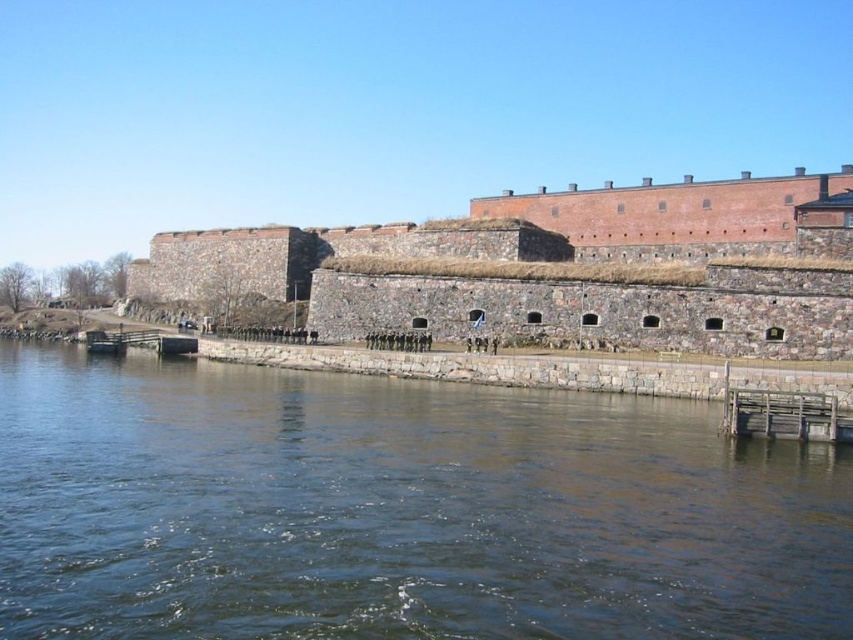
Is dark blue water at center smaller than wooden dock at lower left?

No, dark blue water at center is not smaller than wooden dock at lower left.

How much distance is there between dark blue water at center and wooden dock at lower left?

A distance of 39.29 meters exists between dark blue water at center and wooden dock at lower left.

This screenshot has height=640, width=853. What are the coordinates of `dark blue water at center` in the screenshot? It's located at (398, 509).

Does wooden planks at lower right have a larger size compared to wooden dock at lower left?

Incorrect, wooden planks at lower right is not larger than wooden dock at lower left.

Which is more to the left, wooden planks at lower right or wooden dock at lower left?

From the viewer's perspective, wooden dock at lower left appears more on the left side.

Between point (805, 426) and point (177, 344), which one is positioned in front?

Point (805, 426) is in front.

Where is `wooden planks at lower right`? wooden planks at lower right is located at coordinates (786, 416).

Is brown stone castle at center shorter than wooden dock at lower left?

Incorrect, brown stone castle at center's height does not fall short of wooden dock at lower left's.

The width and height of the screenshot is (853, 640). What do you see at coordinates (555, 268) in the screenshot?
I see `brown stone castle at center` at bounding box center [555, 268].

This screenshot has width=853, height=640. In order to click on brown stone castle at center in this screenshot , I will do `click(555, 268)`.